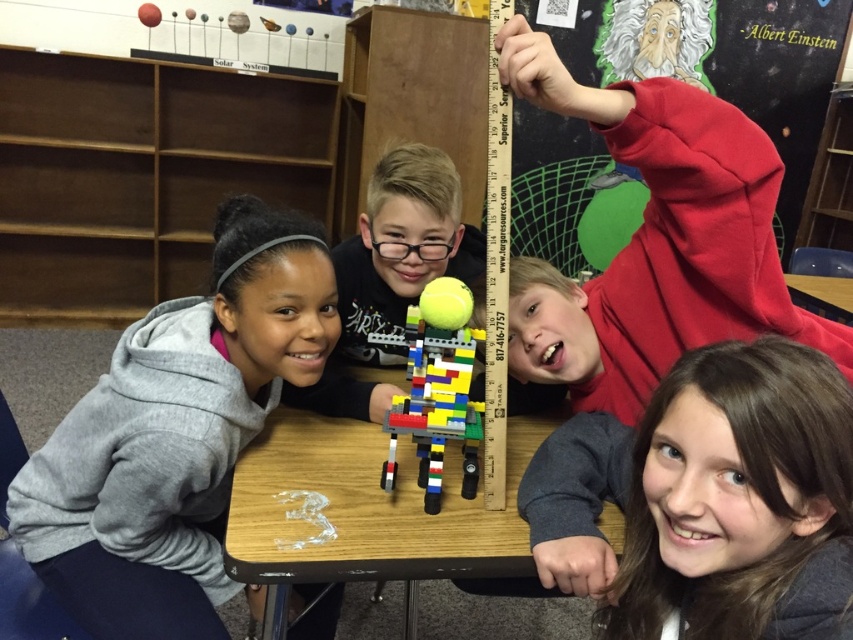
Does gray fleece hoodie at left come in front of multicolored plastic lego robot at center?

No, gray fleece hoodie at left is further to the viewer.

Is gray fleece hoodie at left taller than multicolored plastic lego robot at center?

Indeed, gray fleece hoodie at left has a greater height compared to multicolored plastic lego robot at center.

Locate an element on the screen. gray fleece hoodie at left is located at coordinates (177, 435).

Can you confirm if gray fleece hoodie at left is bigger than wooden table at center?

Yes, gray fleece hoodie at left is bigger than wooden table at center.

Can you confirm if gray fleece hoodie at left is positioned to the right of wooden table at center?

Incorrect, gray fleece hoodie at left is not on the right side of wooden table at center.

Locate an element on the screen. The height and width of the screenshot is (640, 853). gray fleece hoodie at left is located at coordinates point(177,435).

The width and height of the screenshot is (853, 640). I want to click on gray fleece hoodie at left, so click(177, 435).

Between wooden table at center and multicolored plastic lego robot at center, which one has more height?

With more height is multicolored plastic lego robot at center.

Which is in front, point (355, 422) or point (427, 500)?

Point (427, 500)

Where is `wooden table at center`? wooden table at center is located at coordinates (369, 508).